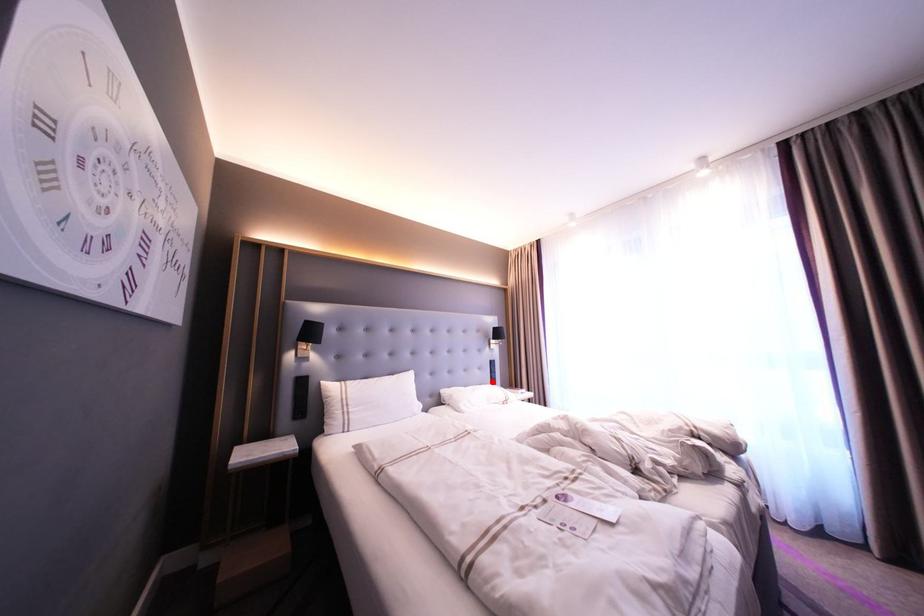
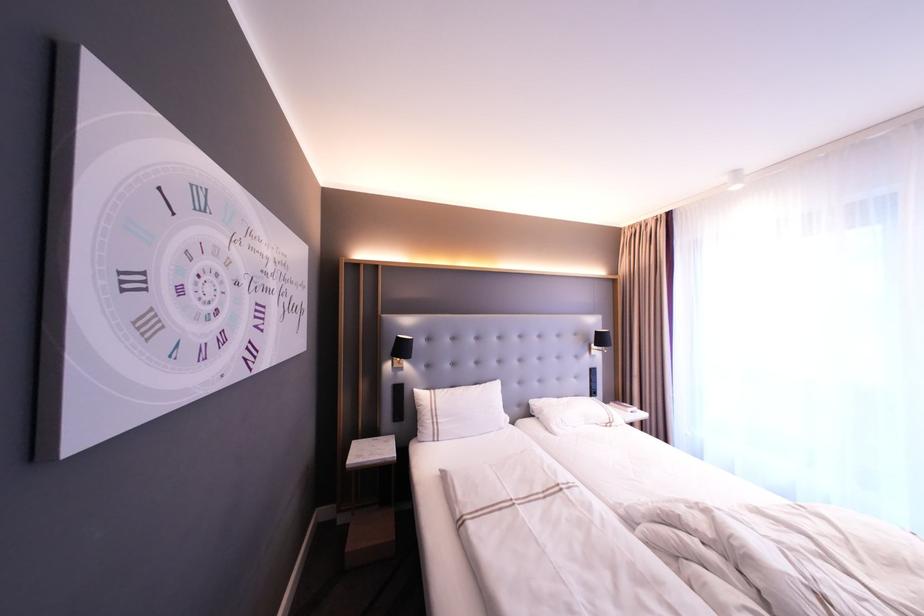
The point at the highlighted location is marked in the first image. Where is the corresponding point in the second image?

(591, 392)